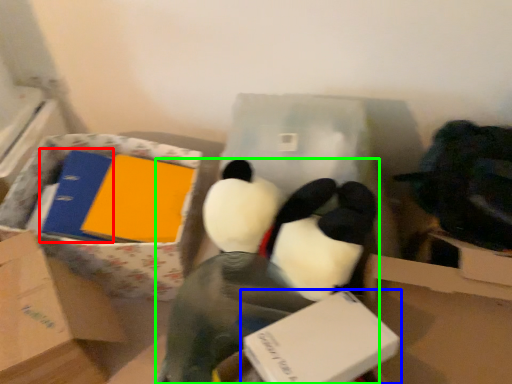
Question: Estimate the real-world distances between objects in this image. Which object is closer to binder (highlighted by a red box), box (highlighted by a blue box) or toy (highlighted by a green box)?

Choices:
 (A) box
 (B) toy

Answer: (B)